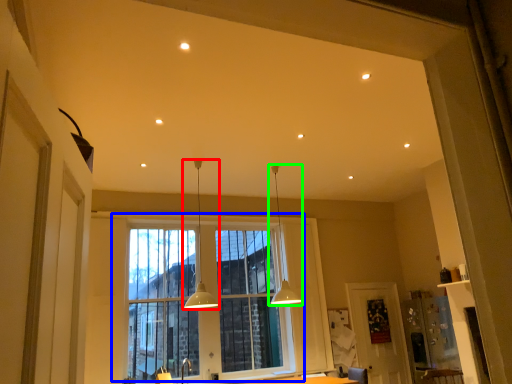
Question: Based on their relative distances, which object is farther from lamp (highlighted by a red box)? Choose from window (highlighted by a blue box) and lamp (highlighted by a green box).

Choices:
 (A) window
 (B) lamp

Answer: (B)